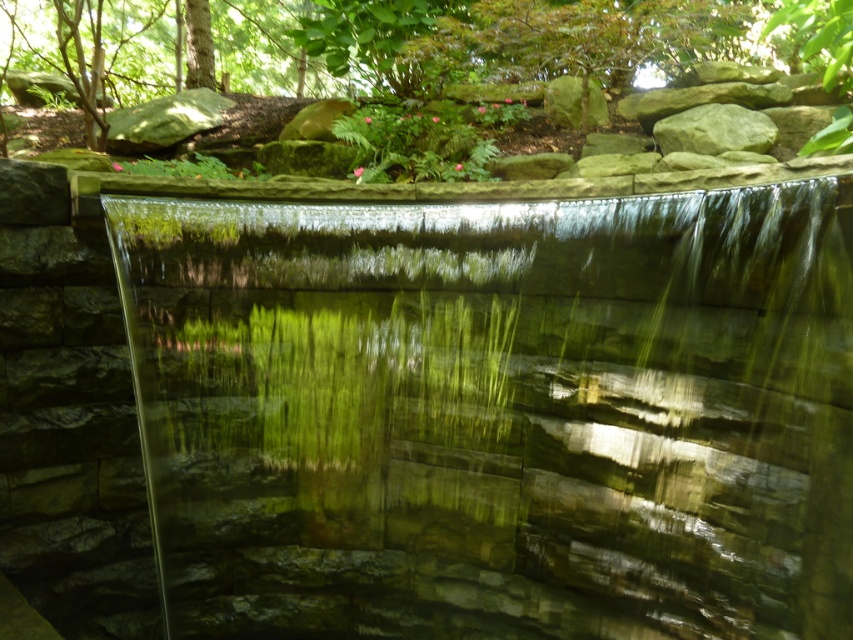
Question: From the image, what is the correct spatial relationship of transparent glass waterfall at center in relation to green rough stone at upper right?

Choices:
 (A) right
 (B) left

Answer: (B)

Question: Can you confirm if transparent glass waterfall at center is positioned above green rough stone at upper right?

Choices:
 (A) no
 (B) yes

Answer: (A)

Question: In this image, where is transparent glass waterfall at center located relative to green rough stone at upper right?

Choices:
 (A) left
 (B) right

Answer: (A)

Question: Which object appears closest to the camera in this image?

Choices:
 (A) green rough stone at upper right
 (B) transparent glass waterfall at center

Answer: (B)

Question: Which of the following is the farthest from the observer?

Choices:
 (A) (837, 529)
 (B) (714, 125)

Answer: (B)